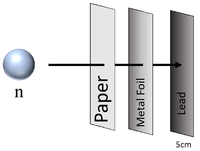
Locate an element on the screen. Image resolution: width=200 pixels, height=151 pixels. one piece of paper is located at coordinates (107, 119).